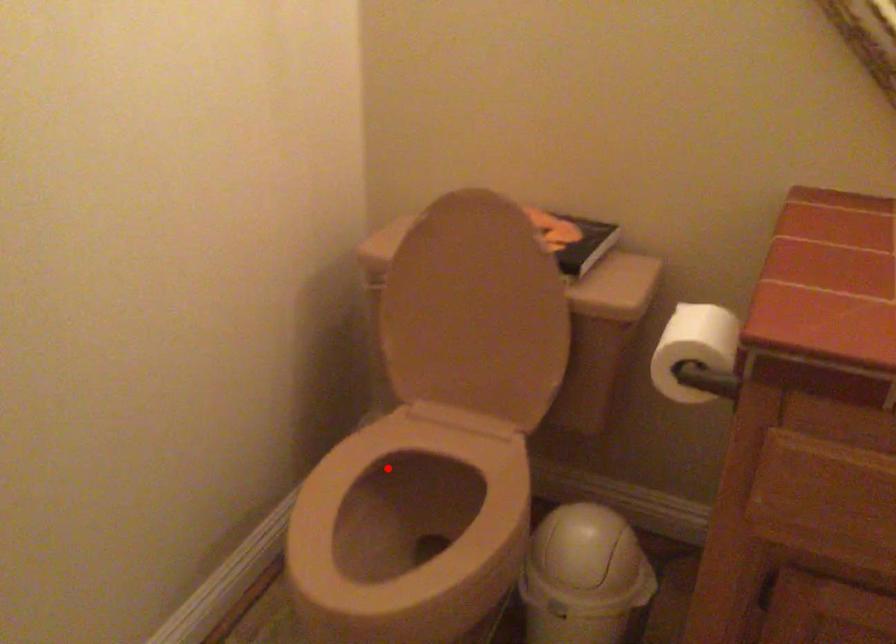
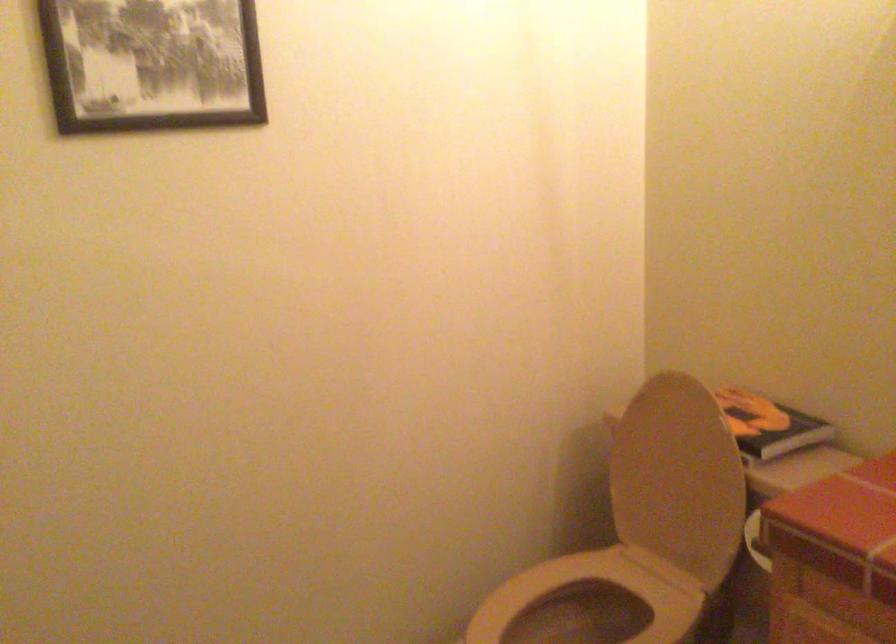
Find the pixel in the second image that matches the highlighted location in the first image.

(599, 592)